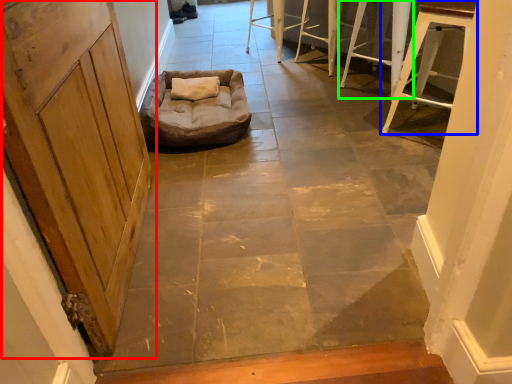
Question: Which object is positioned closest to door (highlighted by a red box)? Select from furniture (highlighted by a blue box) and furniture (highlighted by a green box).

Choices:
 (A) furniture
 (B) furniture

Answer: (A)